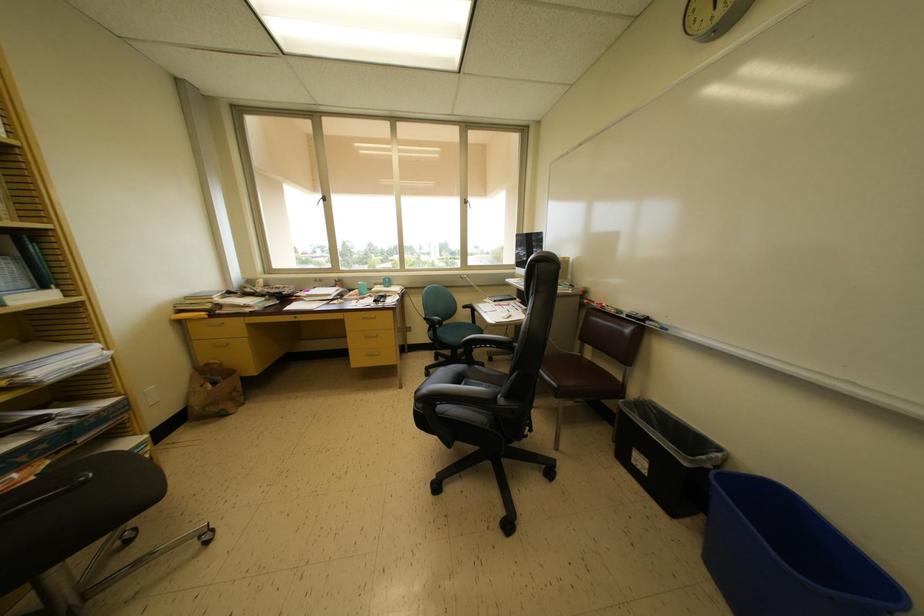
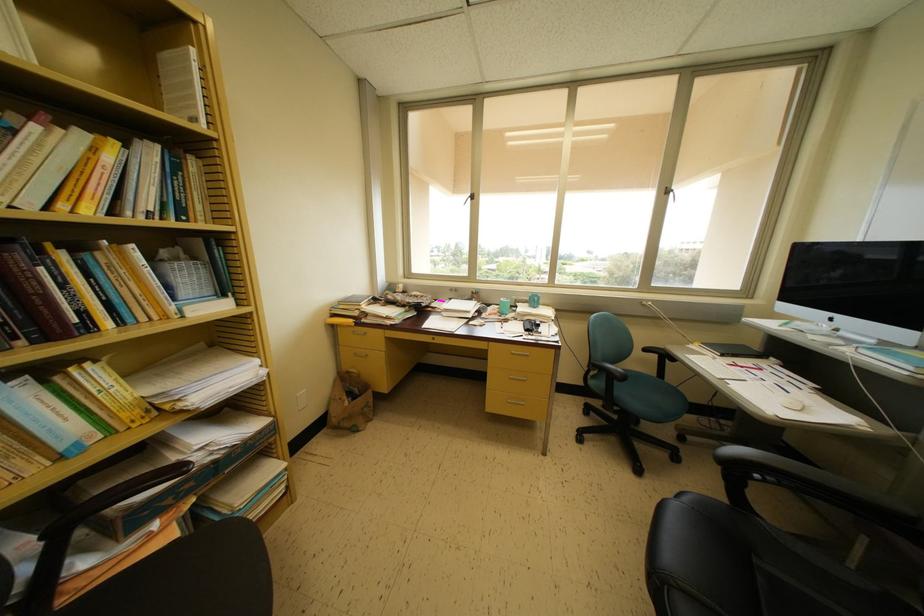
Locate, in the second image, the point that corresponds to point 468,205 in the first image.

(671, 193)